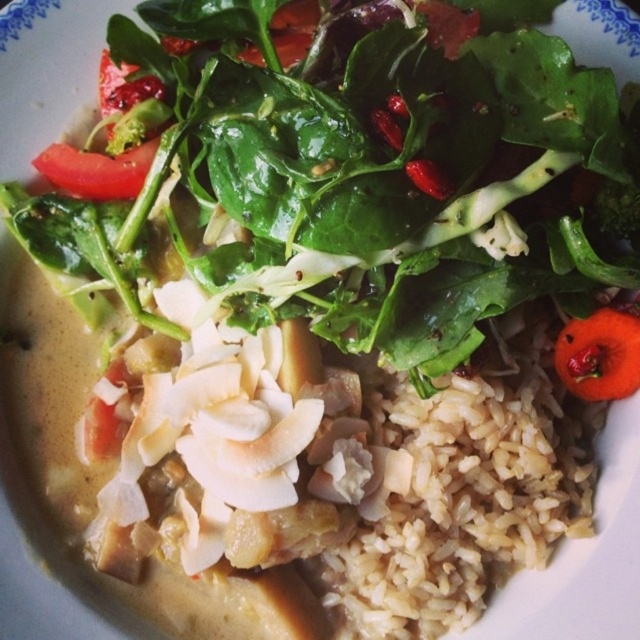
Question: Is brown matte rice at center to the right of red matte tomato at upper right from the viewer's perspective?

Choices:
 (A) yes
 (B) no

Answer: (B)

Question: Which of the following is the farthest from the observer?

Choices:
 (A) (99, 193)
 (B) (458, 435)

Answer: (A)

Question: Can you confirm if red matte tomato at upper right is bigger than red matte tomato at upper left?

Choices:
 (A) yes
 (B) no

Answer: (B)

Question: Is red matte tomato at upper right further to camera compared to red matte tomato at upper left?

Choices:
 (A) yes
 (B) no

Answer: (B)

Question: Which of the following is the farthest from the observer?

Choices:
 (A) red matte tomato at upper right
 (B) brown matte rice at center
 (C) red matte tomato at upper left

Answer: (C)

Question: Among these objects, which one is nearest to the camera?

Choices:
 (A) brown matte rice at center
 (B) red matte tomato at upper left
 (C) red matte tomato at upper right

Answer: (A)